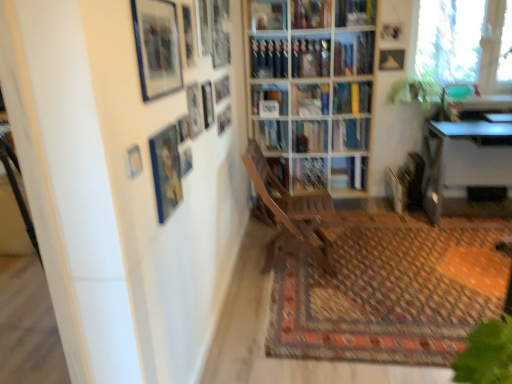
Question: Would you consider blue glossy picture frame at upper left, which appears as the tenth picture frame when viewed from the back, to be distant from wooden chair at center?

Choices:
 (A) yes
 (B) no

Answer: (A)

Question: Is blue glossy picture frame at upper left, which appears as the tenth picture frame when viewed from the back, at the right side of wooden chair at center?

Choices:
 (A) no
 (B) yes

Answer: (A)

Question: Are blue glossy picture frame at upper left, the 2th picture frame in the left-to-right sequence, and wooden chair at center making contact?

Choices:
 (A) yes
 (B) no

Answer: (B)

Question: Is wooden chair at center located within blue glossy picture frame at upper left, the second picture frame positioned from the front?

Choices:
 (A) no
 (B) yes

Answer: (A)

Question: From the image's perspective, would you say blue glossy picture frame at upper left, the second picture frame positioned from the front, is positioned over wooden chair at center?

Choices:
 (A) no
 (B) yes

Answer: (B)

Question: From the image's perspective, is blue glossy picture frame at upper left, which appears as the tenth picture frame when viewed from the back, positioned above or below matte black picture frame at upper right, the 1th picture frame viewed from the back?

Choices:
 (A) above
 (B) below

Answer: (B)

Question: Which is correct: blue glossy picture frame at upper left, the 2th picture frame in the left-to-right sequence, is inside matte black picture frame at upper right, the 1th picture frame viewed from the back, or outside of it?

Choices:
 (A) outside
 (B) inside

Answer: (A)

Question: Looking at their shapes, would you say blue glossy picture frame at upper left, the 2th picture frame in the left-to-right sequence, is wider or thinner than matte black picture frame at upper right, the 1th picture frame viewed from the back?

Choices:
 (A) thin
 (B) wide

Answer: (B)

Question: From a real-world perspective, is blue glossy picture frame at upper left, the second picture frame positioned from the front, positioned above or below matte black picture frame at upper right, the 11th picture frame from the front?

Choices:
 (A) above
 (B) below

Answer: (A)

Question: Choose the correct answer: Is matte black picture frame at upper center, the 2th picture frame in the back-to-front sequence, inside metallic silver picture frame at upper center, the 9th picture frame positioned from the left, or outside it?

Choices:
 (A) inside
 (B) outside

Answer: (B)

Question: Would you say matte black picture frame at upper center, the 2th picture frame in the back-to-front sequence, is to the left or to the right of metallic silver picture frame at upper center, which appears as the 3th picture frame when viewed from the right, in the picture?

Choices:
 (A) left
 (B) right

Answer: (B)

Question: In terms of width, does matte black picture frame at upper center, which is the tenth picture frame in front-to-back order, look wider or thinner when compared to metallic silver picture frame at upper center, the 9th picture frame positioned from the left?

Choices:
 (A) thin
 (B) wide

Answer: (B)

Question: Relative to metallic silver picture frame at upper center, the 9th picture frame positioned from the left, is matte black picture frame at upper center, the 2th picture frame in the back-to-front sequence, in front or behind?

Choices:
 (A) front
 (B) behind

Answer: (B)

Question: Considering the positions of matte black picture frame at upper center, the seventh picture frame positioned from the left, and metallic silver picture frame at upper center, positioned as the ninth picture frame in front-to-back order, in the image, is matte black picture frame at upper center, the seventh picture frame positioned from the left, wider or thinner than metallic silver picture frame at upper center, positioned as the ninth picture frame in front-to-back order,?

Choices:
 (A) thin
 (B) wide

Answer: (A)

Question: From the image's perspective, relative to metallic silver picture frame at upper center, positioned as the ninth picture frame in front-to-back order, is matte black picture frame at upper center, the seventh picture frame positioned from the left, above or below?

Choices:
 (A) above
 (B) below

Answer: (B)